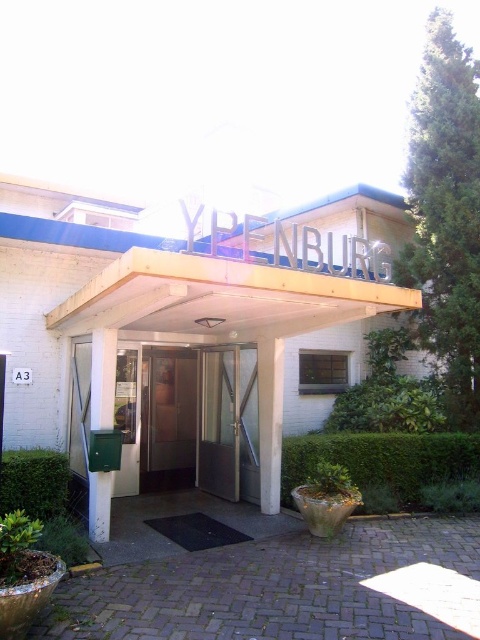
Who is more distant from viewer, (267, 358) or (192, 454)?

The point (192, 454) is more distant.

Is point (19, 397) in front of point (184, 474)?

That is True.

Is point (162, 417) closer to viewer compared to point (156, 394)?

No, (162, 417) is behind (156, 394).

Find the location of a particular element. The height and width of the screenshot is (640, 480). white wooden entrance at center is located at coordinates (188, 333).